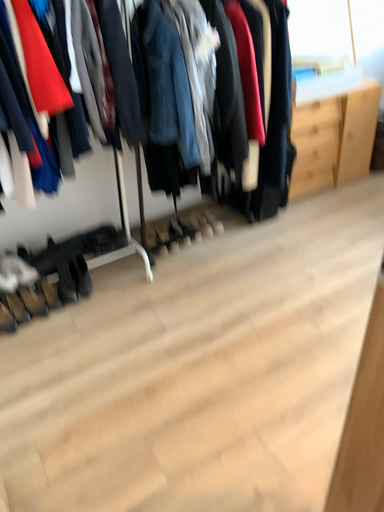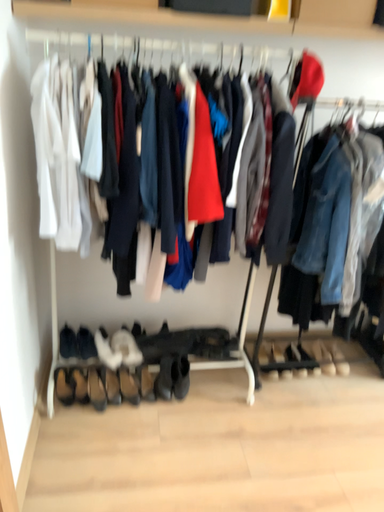
Question: Which way did the camera rotate in the video?

Choices:
 (A) rotated upward
 (B) rotated downward

Answer: (A)